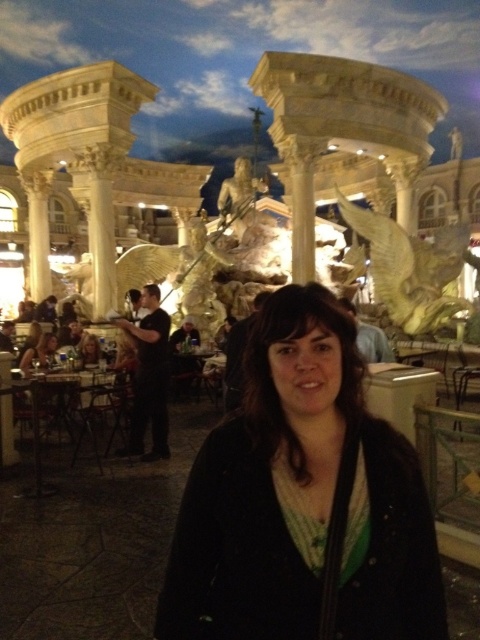
Is matte black hair at lower center taller than matte black hair at lower left?

Yes, matte black hair at lower center is taller than matte black hair at lower left.

Does matte black hair at lower center have a lesser height compared to matte black hair at lower left?

In fact, matte black hair at lower center may be taller than matte black hair at lower left.

You are a GUI agent. You are given a task and a screenshot of the screen. Output one action in this format:
    pyautogui.click(x=<x>, y=<y>)
    Task: Click on the matte black hair at lower center
    The height and width of the screenshot is (640, 480).
    Given the screenshot: What is the action you would take?
    pyautogui.click(x=38, y=352)

Consider the image. How far apart are black matte jacket at center and matte black hair at lower left?

34.94 meters

Is point (285, 472) more distant than point (83, 356)?

That is False.

Is point (305, 433) in front of point (81, 342)?

Yes.

Where is `black matte jacket at center`? Image resolution: width=480 pixels, height=640 pixels. black matte jacket at center is located at coordinates (308, 497).

Does black matte jacket at center come in front of matte black hair at lower center?

Yes, it is.

How much distance is there between black matte jacket at center and matte black hair at lower center?

They are 35.23 meters apart.

Is point (311, 440) positioned before point (33, 358)?

That is True.

You are a GUI agent. You are given a task and a screenshot of the screen. Output one action in this format:
    pyautogui.click(x=<x>, y=<y>)
    Task: Click on the black matte jacket at center
    This screenshot has height=640, width=480.
    Given the screenshot: What is the action you would take?
    pyautogui.click(x=308, y=497)